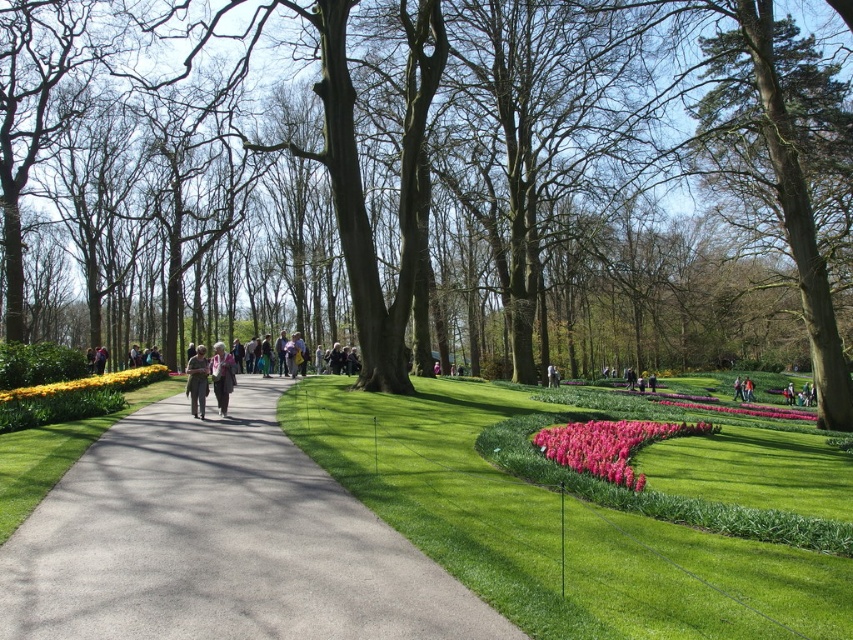
Which is more to the right, gray asphalt path at center or matte gray jacket at center?

gray asphalt path at center is more to the right.

Based on the photo, does gray asphalt path at center lie in front of matte gray jacket at center?

Yes.

Does point (287, 468) come behind point (202, 349)?

No, it is not.

Where is `gray asphalt path at center`? The width and height of the screenshot is (853, 640). gray asphalt path at center is located at coordinates (219, 544).

Does light brown fabric jacket at center have a greater width compared to light brown leather jacket at center?

In fact, light brown fabric jacket at center might be narrower than light brown leather jacket at center.

Between point (218, 394) and point (740, 388), which one is positioned behind?

The point (740, 388) is behind.

I want to click on light brown fabric jacket at center, so click(222, 376).

Is pink glossy flower at center to the right of light brown leather jacket at center from the viewer's perspective?

No, pink glossy flower at center is not to the right of light brown leather jacket at center.

The height and width of the screenshot is (640, 853). I want to click on pink glossy flower at center, so click(x=608, y=444).